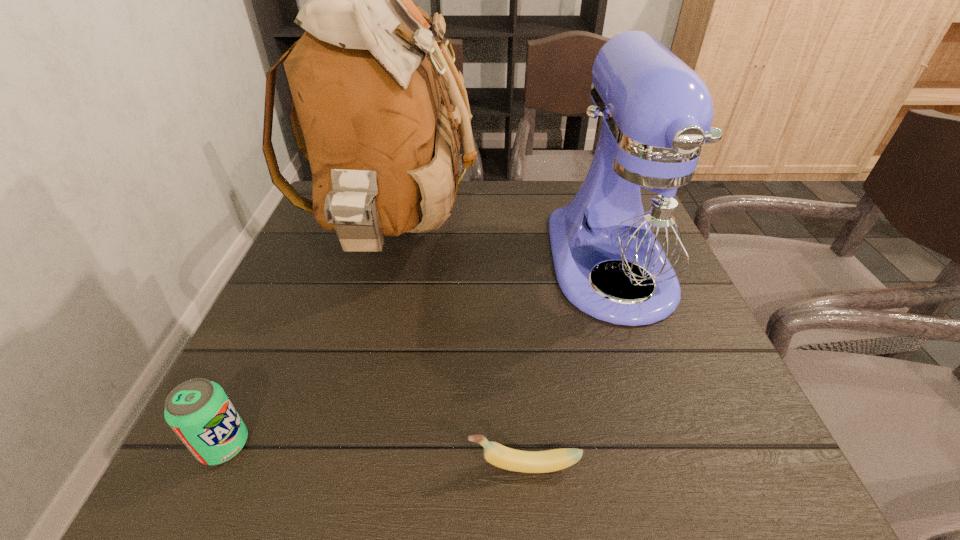
At what (x,y) coordinates should I click in order to perform the action: click on vacant space that is in between the backpack and the pop soda. Please return your answer as a coordinate pair (x, y). Looking at the image, I should click on (309, 340).

This screenshot has height=540, width=960. I want to click on vacant space that is in between the backpack and the mixer, so click(x=502, y=249).

Locate an element on the screen. The image size is (960, 540). free spot between the tallest object and the second shortest object is located at coordinates (309, 340).

Where is `unoccupied area between the shortest object and the second shortest object`? The height and width of the screenshot is (540, 960). unoccupied area between the shortest object and the second shortest object is located at coordinates (374, 455).

Where is `vacant space that is in between the backpack and the second tallest object`? Image resolution: width=960 pixels, height=540 pixels. vacant space that is in between the backpack and the second tallest object is located at coordinates (502, 249).

Point out which object is positioned as the third nearest to the tallest object. Please provide its 2D coordinates. Your answer should be formatted as a tuple, i.e. [(x, y)], where the tuple contains the x and y coordinates of a point satisfying the conditions above.

[(496, 454)]

At what (x,y) coordinates should I click in order to perform the action: click on the closest object to the third tallest object. Please return your answer as a coordinate pair (x, y). Looking at the image, I should click on (367, 78).

Where is `vacant space that satisfies the following two spatial constraints: 1. at the mixing area of the third shortest object; 2. on the front-facing side of the pop soda`? vacant space that satisfies the following two spatial constraints: 1. at the mixing area of the third shortest object; 2. on the front-facing side of the pop soda is located at coordinates (674, 445).

Identify the location of free location that satisfies the following two spatial constraints: 1. at the mixing area of the rightmost object; 2. on the front-facing side of the third tallest object. The height and width of the screenshot is (540, 960). (674, 445).

This screenshot has height=540, width=960. Find the location of `vacant space that satisfies the following two spatial constraints: 1. at the mixing area of the rightmost object; 2. at the stem of the banana`. vacant space that satisfies the following two spatial constraints: 1. at the mixing area of the rightmost object; 2. at the stem of the banana is located at coordinates (682, 466).